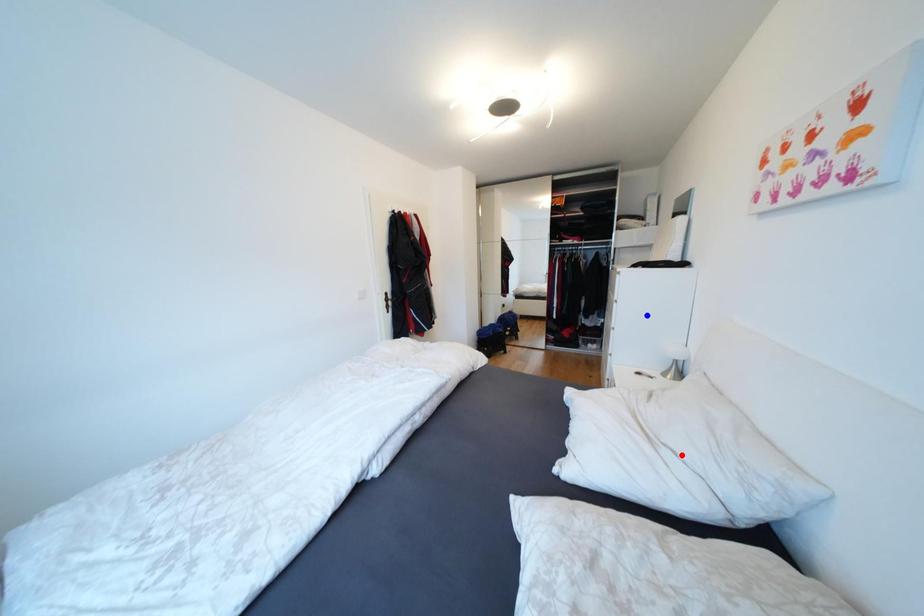
Question: Which of the two points in the image is closer to the camera?

Choices:
 (A) Blue point is closer.
 (B) Red point is closer.

Answer: (B)